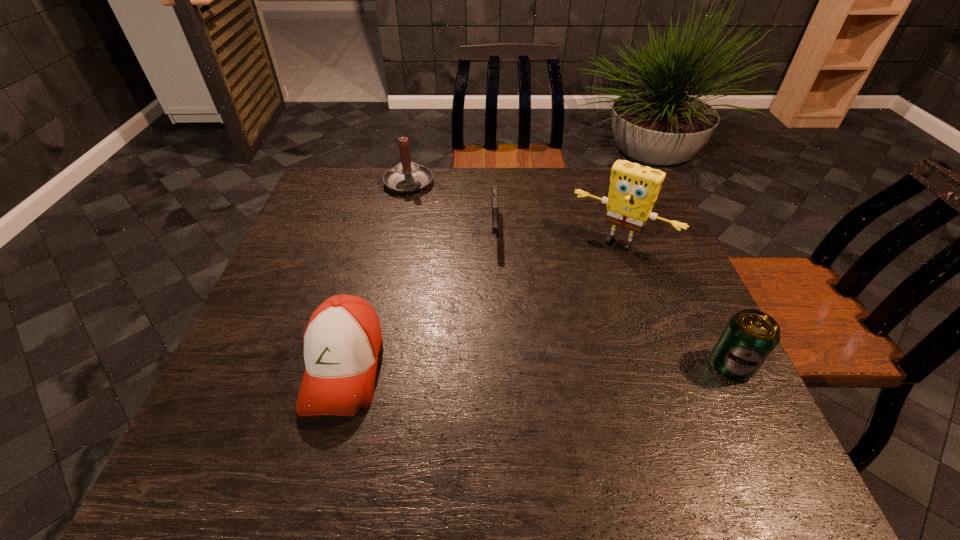
The image size is (960, 540). I want to click on free space between the baseball cap and the beer can, so click(538, 366).

Where is `free space between the baseball cap and the tallest object`? Image resolution: width=960 pixels, height=540 pixels. free space between the baseball cap and the tallest object is located at coordinates (482, 305).

This screenshot has height=540, width=960. In order to click on blank region between the baseball cap and the third object from right to left in this screenshot , I will do `click(420, 297)`.

Identify which object is the third closest to the second tallest object. Please provide its 2D coordinates. Your answer should be formatted as a tuple, i.e. [(x, y)], where the tuple contains the x and y coordinates of a point satisfying the conditions above.

[(342, 341)]

Locate which object ranks in proximity to the gun. Please provide its 2D coordinates. Your answer should be formatted as a tuple, i.e. [(x, y)], where the tuple contains the x and y coordinates of a point satisfying the conditions above.

[(406, 177)]

Find the location of a particular element. free spot that satisfies the following two spatial constraints: 1. on the front side of the third object from right to left; 2. on the right side of the sponge is located at coordinates (495, 242).